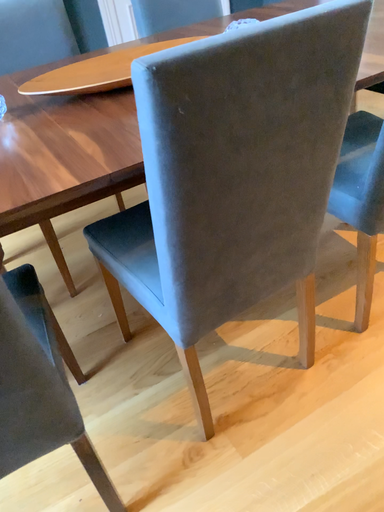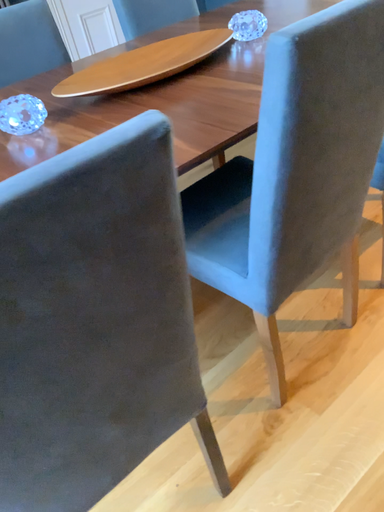
Question: Which way did the camera rotate in the video?

Choices:
 (A) rotated left
 (B) rotated right

Answer: (B)